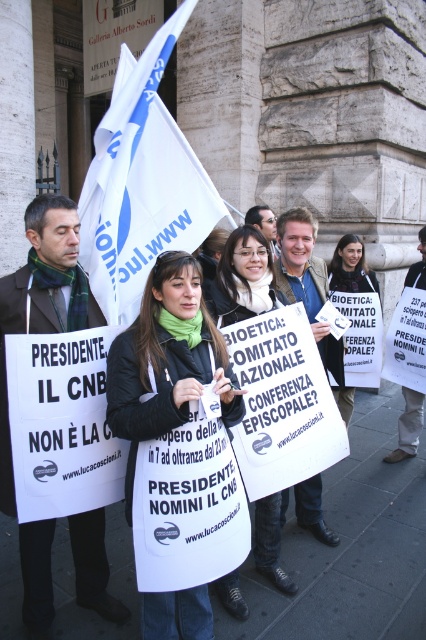
You are a photographer at the protest, and you want to capture a clear photo of the white paper sign at center and the matte black jacket at center. Since the sign is larger, will it be easier to focus on the sign compared to the jacket?

The white paper sign at center is larger in size than the matte black jacket at center, so it will be easier to focus on the white paper sign at center because larger objects generally provide more visual detail for autofocus systems to lock onto.

You are a photographer standing at the front of the demonstration. You want to take a photo that includes both the white fabric flag at upper center and the black fabric jacket at center. The minimum distance between the two objects in the photo must be at least 4 feet. Can you capture both in the same frame?

The white fabric flag at upper center is 4.34 feet away from the black fabric jacket at center. Since 4.34 feet is greater than the required 4 feet, yes, you can capture both in the same frame as the distance meets the minimum requirement.

What is located at the point with coordinates (141,182) in the image?

The point at coordinates (141,182) marks the location of the white fabric flag at upper center.